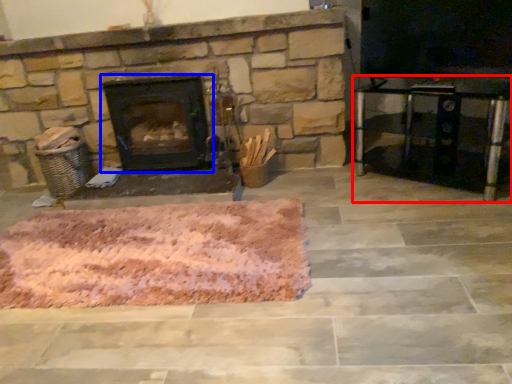
Question: Which point is further to the camera, entertainment center (highlighted by a red box) or wood burning stove (highlighted by a blue box)?

Choices:
 (A) entertainment center
 (B) wood burning stove

Answer: (B)